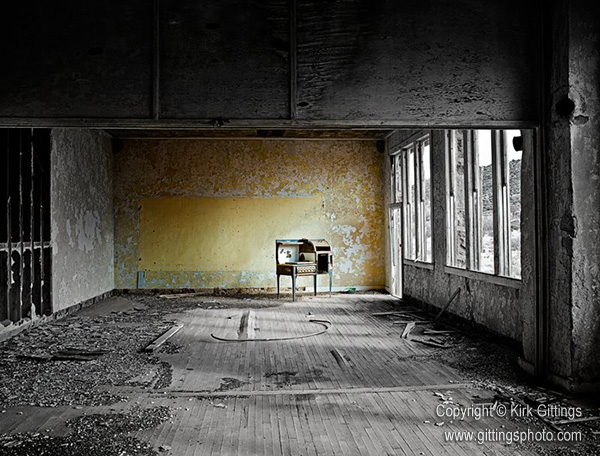
You are a GUI agent. You are given a task and a screenshot of the screen. Output one action in this format:
    pyautogui.click(x=<x>, y=<y>)
    Task: Click on the wood floor
    This screenshot has height=456, width=600.
    Given the screenshot: What is the action you would take?
    pyautogui.click(x=349, y=399)